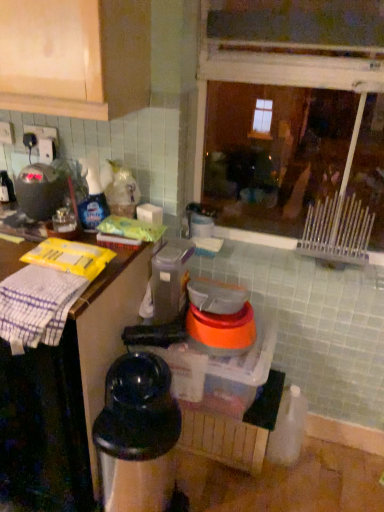
Question: Does transparent glass window at upper center appear on the right side of matte black kettle at left, marked as the 1th appliance in a top-to-bottom arrangement?

Choices:
 (A) no
 (B) yes

Answer: (B)

Question: From the image's perspective, is transparent glass window at upper center on top of matte black kettle at left, which appears as the third appliance when viewed from the right?

Choices:
 (A) yes
 (B) no

Answer: (A)

Question: Is there a large distance between transparent glass window at upper center and matte black kettle at left, marked as the 1th appliance in a top-to-bottom arrangement?

Choices:
 (A) yes
 (B) no

Answer: (A)

Question: Is transparent glass window at upper center bigger than matte black kettle at left, which is the 3th appliance in bottom-to-top order?

Choices:
 (A) yes
 (B) no

Answer: (A)

Question: Can you confirm if transparent glass window at upper center is shorter than matte black kettle at left, placed as the first appliance when sorted from left to right?

Choices:
 (A) no
 (B) yes

Answer: (A)

Question: Is orange plastic bowls at center, positioned as the 3th appliance in left-to-right order, wider or thinner than white checkered cloth at left?

Choices:
 (A) thin
 (B) wide

Answer: (B)

Question: Is orange plastic bowls at center, positioned as the 3th appliance in left-to-right order, to the left or to the right of white checkered cloth at left in the image?

Choices:
 (A) right
 (B) left

Answer: (A)

Question: From the image's perspective, is orange plastic bowls at center, the 2th appliance ordered from the bottom, above or below white checkered cloth at left?

Choices:
 (A) above
 (B) below

Answer: (B)

Question: Is point (223, 348) closer or farther from the camera than point (59, 326)?

Choices:
 (A) closer
 (B) farther

Answer: (B)

Question: Is white checkered cloth at left in front of or behind matte black kettle at left, marked as the 1th appliance in a top-to-bottom arrangement, in the image?

Choices:
 (A) behind
 (B) front

Answer: (B)

Question: Considering the positions of white checkered cloth at left and matte black kettle at left, which is the 3th appliance in bottom-to-top order, in the image, is white checkered cloth at left bigger or smaller than matte black kettle at left, which is the 3th appliance in bottom-to-top order,?

Choices:
 (A) big
 (B) small

Answer: (A)

Question: Does point (66, 311) appear closer or farther from the camera than point (36, 216)?

Choices:
 (A) farther
 (B) closer

Answer: (B)

Question: Is white checkered cloth at left situated inside matte black kettle at left, which is the 3th appliance in bottom-to-top order, or outside?

Choices:
 (A) outside
 (B) inside

Answer: (A)

Question: From the image's perspective, relative to white cloth at left, is orange plastic bowls at center, positioned as the 3th appliance in left-to-right order, above or below?

Choices:
 (A) below
 (B) above

Answer: (B)

Question: Considering the positions of orange plastic bowls at center, the second appliance when ordered from top to bottom, and white cloth at left in the image, is orange plastic bowls at center, the second appliance when ordered from top to bottom, taller or shorter than white cloth at left?

Choices:
 (A) tall
 (B) short

Answer: (B)